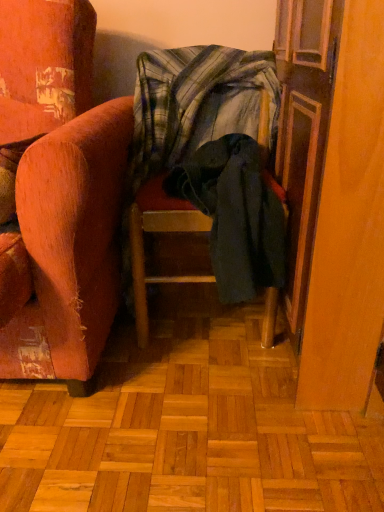
Question: Considering the relative sizes of dark green fabric chair at center and plaid fabric blanket at center in the image provided, is dark green fabric chair at center bigger than plaid fabric blanket at center?

Choices:
 (A) no
 (B) yes

Answer: (B)

Question: Is dark green fabric chair at center facing away from plaid fabric blanket at center?

Choices:
 (A) no
 (B) yes

Answer: (A)

Question: Does dark green fabric chair at center appear on the left side of plaid fabric blanket at center?

Choices:
 (A) yes
 (B) no

Answer: (B)

Question: Is dark green fabric chair at center further to camera compared to plaid fabric blanket at center?

Choices:
 (A) no
 (B) yes

Answer: (A)

Question: From a real-world perspective, does dark green fabric chair at center sit lower than plaid fabric blanket at center?

Choices:
 (A) no
 (B) yes

Answer: (B)

Question: Would you say plaid fabric blanket at center is part of dark green fabric chair at center's contents?

Choices:
 (A) no
 (B) yes

Answer: (A)

Question: Does plaid fabric blanket at center turn towards dark green fabric chair at center?

Choices:
 (A) yes
 (B) no

Answer: (B)

Question: From a real-world perspective, is plaid fabric blanket at center over dark green fabric chair at center?

Choices:
 (A) no
 (B) yes

Answer: (B)

Question: Does plaid fabric blanket at center have a smaller size compared to dark green fabric chair at center?

Choices:
 (A) yes
 (B) no

Answer: (A)

Question: Considering the relative sizes of plaid fabric blanket at center and dark green fabric chair at center in the image provided, is plaid fabric blanket at center wider than dark green fabric chair at center?

Choices:
 (A) yes
 (B) no

Answer: (B)

Question: Does plaid fabric blanket at center have a greater height compared to dark green fabric chair at center?

Choices:
 (A) no
 (B) yes

Answer: (A)

Question: Are plaid fabric blanket at center and dark green fabric chair at center making contact?

Choices:
 (A) no
 (B) yes

Answer: (A)

Question: Would you say wooden screen door at right is part of dark green fabric chair at center's contents?

Choices:
 (A) no
 (B) yes

Answer: (A)